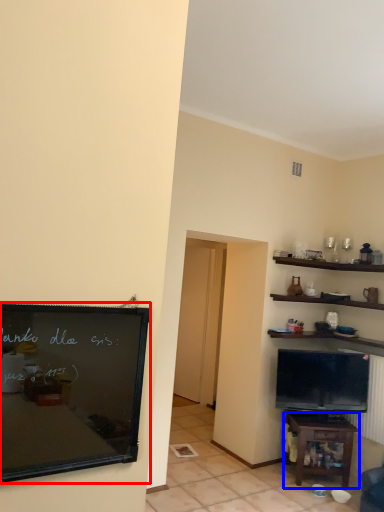
Question: Which object is closer to the camera taking this photo, bulletin board (highlighted by a red box) or table (highlighted by a blue box)?

Choices:
 (A) bulletin board
 (B) table

Answer: (A)